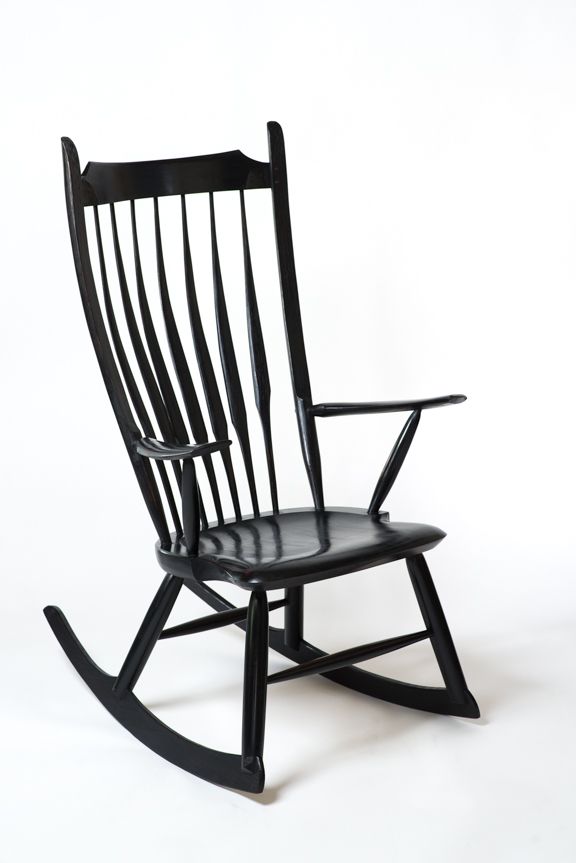
Where is `shadow of the chair`? Image resolution: width=576 pixels, height=863 pixels. shadow of the chair is located at coordinates (328, 759), (266, 795), (187, 698), (502, 664).